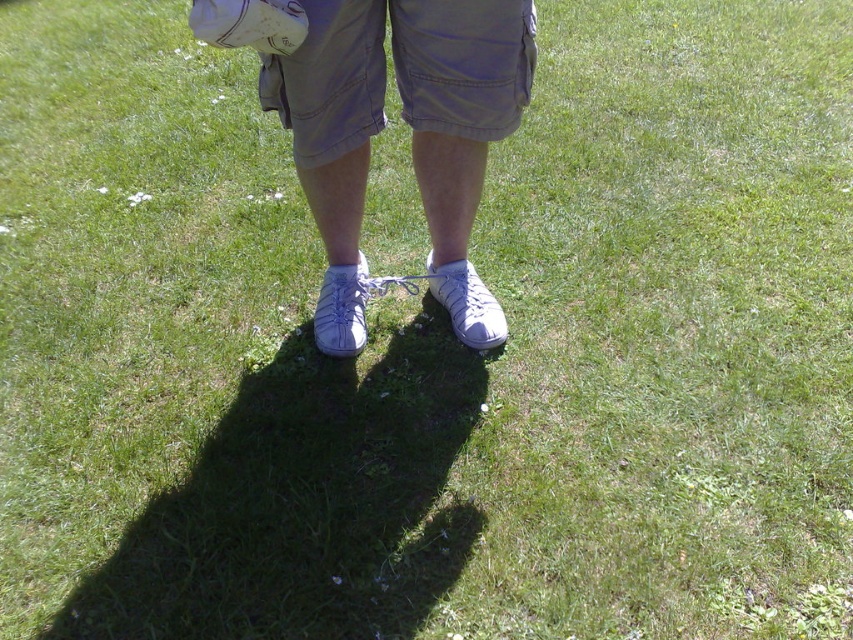
Question: Which object is closer to the camera taking this photo?

Choices:
 (A) white leather sneakers at center
 (B) khaki cotton shorts at center

Answer: (A)

Question: Does white leather sneakers at center appear on the right side of khaki cotton shorts at center?

Choices:
 (A) yes
 (B) no

Answer: (B)

Question: Is white leather sneakers at center above khaki cotton shorts at center?

Choices:
 (A) no
 (B) yes

Answer: (A)

Question: Does white leather sneakers at center have a smaller size compared to khaki cotton shorts at center?

Choices:
 (A) yes
 (B) no

Answer: (B)

Question: Which of the following is the farthest from the observer?

Choices:
 (A) (321, 216)
 (B) (375, 83)

Answer: (A)